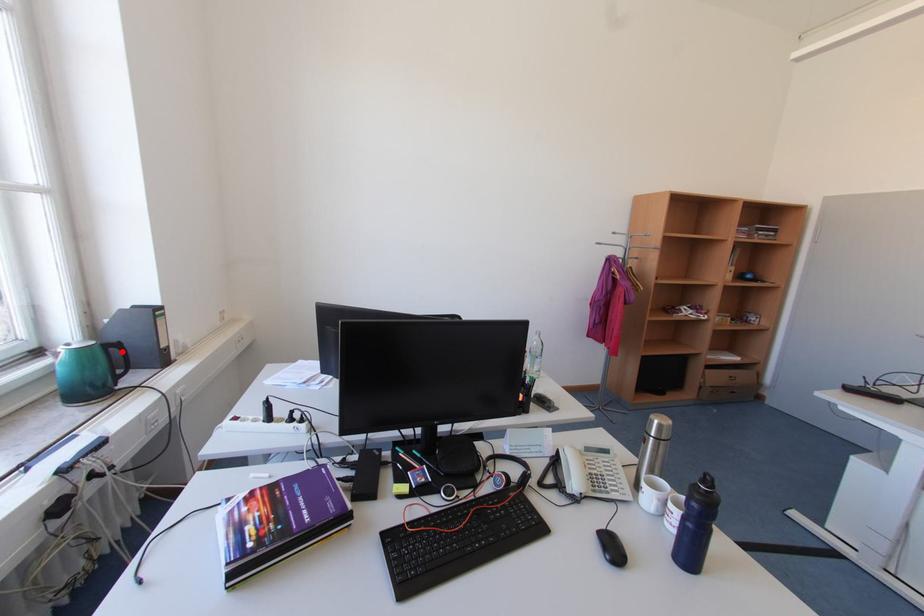
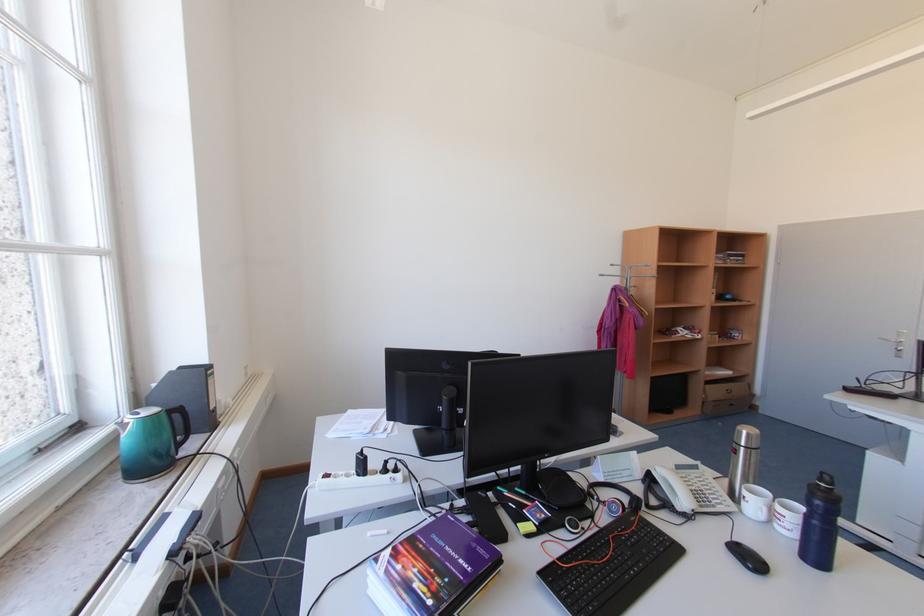
The point at the highlighted location is marked in the first image. Where is the corresponding point in the second image?

(185, 416)